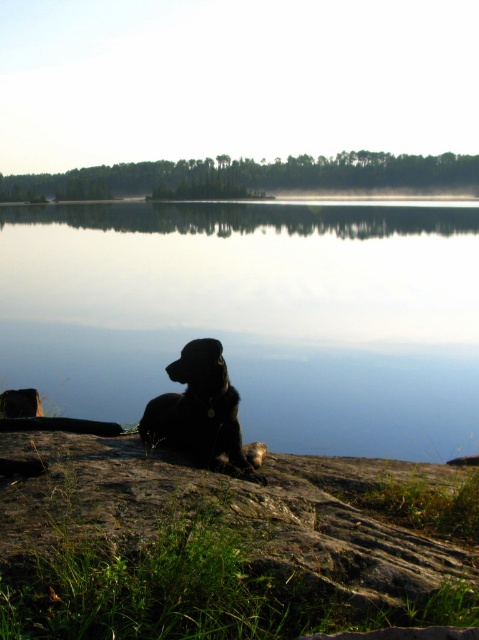
Question: Which point appears farthest from the camera in this image?

Choices:
 (A) (429, 413)
 (B) (221, 532)

Answer: (A)

Question: Which point is farther to the camera?

Choices:
 (A) rough textured rock at lower center
 (B) transparent water at center

Answer: (B)

Question: Is rough textured rock at lower center positioned in front of black fur dog at lower center?

Choices:
 (A) yes
 (B) no

Answer: (A)

Question: Does transparent water at center come behind rough textured rock at lower center?

Choices:
 (A) no
 (B) yes

Answer: (B)

Question: Where is transparent water at center located in relation to black fur dog at lower center in the image?

Choices:
 (A) right
 (B) left

Answer: (A)

Question: Which object is the farthest from the transparent water at center?

Choices:
 (A) black fur dog at lower center
 (B) rough textured rock at lower center

Answer: (B)